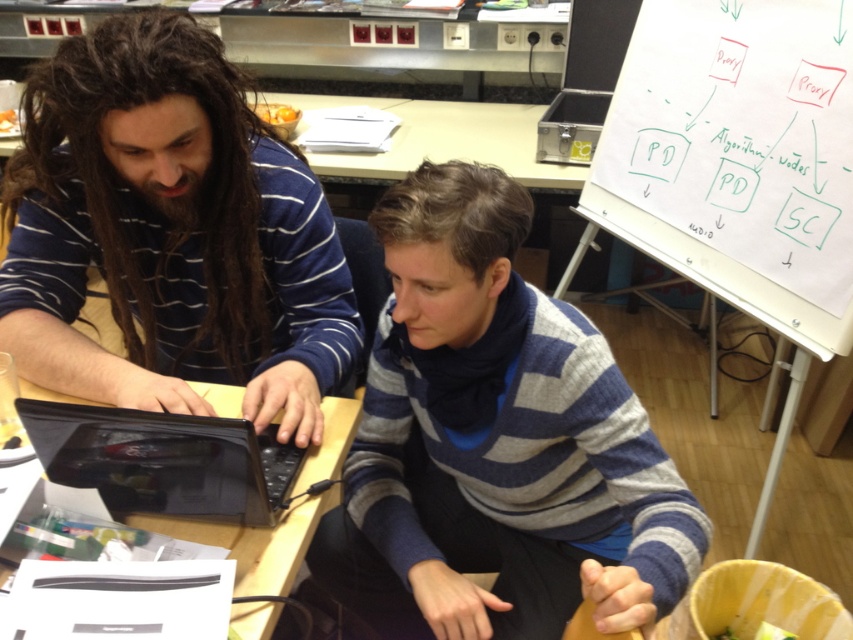
You are a delivery robot with a 10 inch wide package. You need to place it on the desk between the matte striped sweater at left and the black plastic laptop at center. Is there enough space for the package?

The matte striped sweater at left is 9.88 inches away from the black plastic laptop at center, so there is not enough space to place a 10 inch wide package between them.